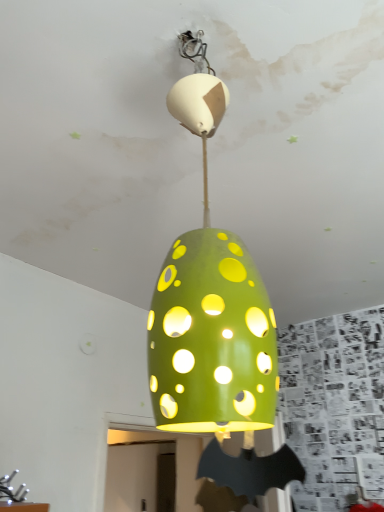
Where is `green matte lampshade at center`? This screenshot has height=512, width=384. green matte lampshade at center is located at coordinates (215, 325).

Describe the element at coordinates (215, 325) in the screenshot. I see `green matte lampshade at center` at that location.

Where is `green matte lampshade at center`? Image resolution: width=384 pixels, height=512 pixels. green matte lampshade at center is located at coordinates coord(215,325).